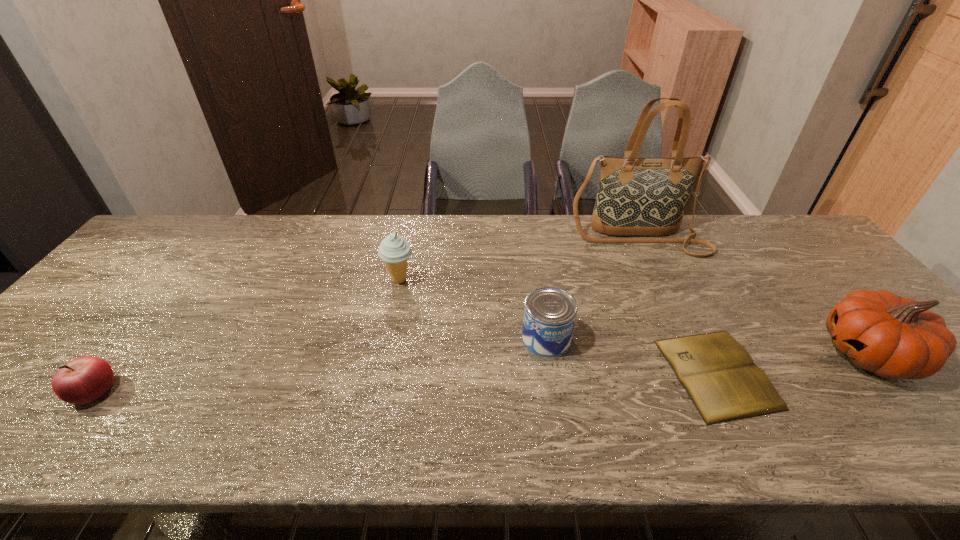
The width and height of the screenshot is (960, 540). In order to click on the farthest object in this screenshot , I will do `click(636, 196)`.

Identify the location of handbag. (636, 196).

Locate an element on the screen. the rightmost object is located at coordinates (895, 337).

This screenshot has width=960, height=540. I want to click on the second object from left to right, so click(394, 250).

Locate an element on the screen. This screenshot has width=960, height=540. the second farthest object is located at coordinates (394, 250).

The height and width of the screenshot is (540, 960). I want to click on the fourth tallest object, so click(x=549, y=315).

Locate an element on the screen. The image size is (960, 540). can is located at coordinates (549, 315).

Where is `apple`? apple is located at coordinates (83, 380).

Identify the location of the fifth tallest object. (83, 380).

Locate an element on the screen. The height and width of the screenshot is (540, 960). the shortest object is located at coordinates (719, 375).